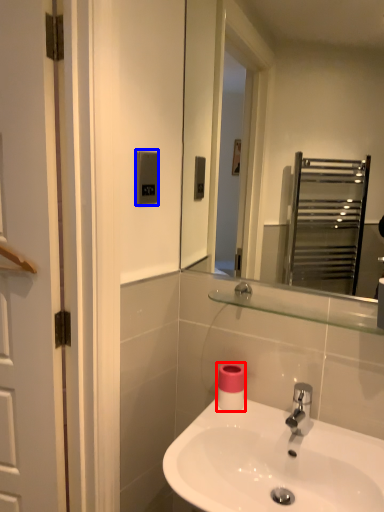
Question: Which point is closer to the camera, toilet paper (highlighted by a red box) or light switch (highlighted by a blue box)?

Choices:
 (A) toilet paper
 (B) light switch

Answer: (B)